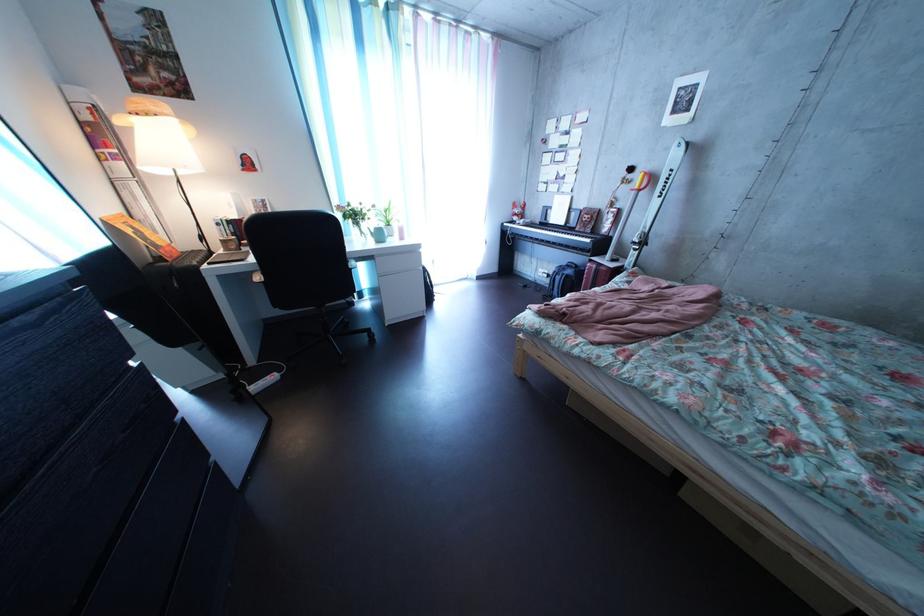
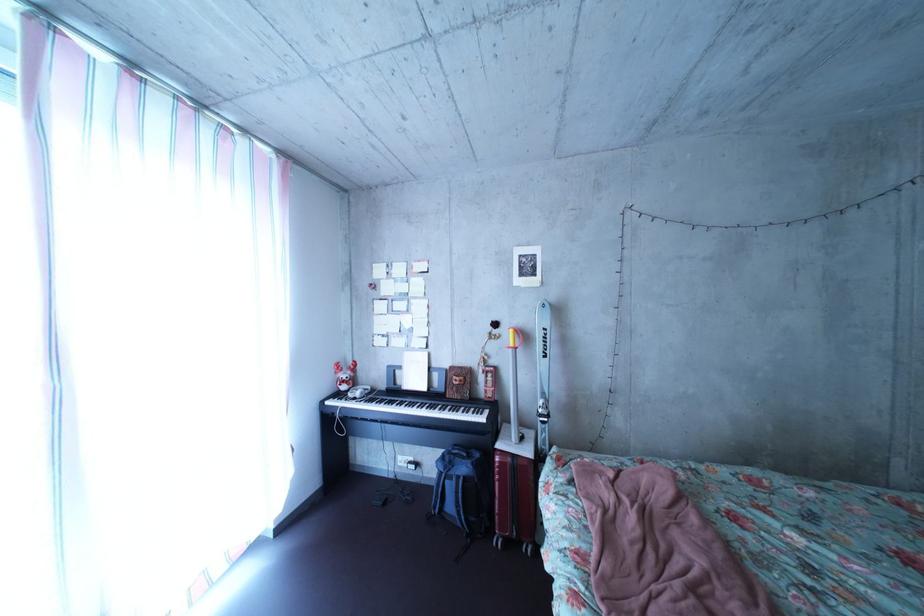
Find the pixel in the second image that matches (588,231) in the first image.

(452, 392)